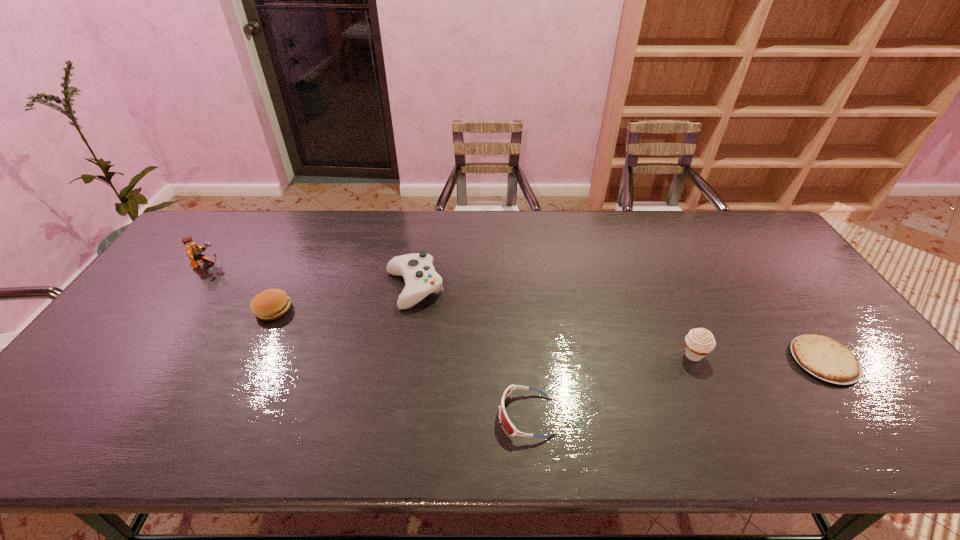
In order to click on the leftmost object in this screenshot , I will do `click(193, 250)`.

Locate an element on the screen. the fifth object from left to right is located at coordinates (699, 342).

The image size is (960, 540). What are the coordinates of `the fourth shortest object` in the screenshot? It's located at (421, 279).

Where is `the third object from left to right`? the third object from left to right is located at coordinates click(421, 279).

Find the location of `patty`. patty is located at coordinates (270, 304).

Find the location of a particular element. the fourth object from left to right is located at coordinates (505, 421).

Where is `goggles`? This screenshot has width=960, height=540. goggles is located at coordinates (505, 421).

At what (x,y) coordinates should I click in order to perform the action: click on the shortest object. Please return your answer as a coordinate pair (x, y). Image resolution: width=960 pixels, height=540 pixels. Looking at the image, I should click on (x=824, y=357).

At what (x,y) coordinates should I click in order to perform the action: click on the rightmost object. Please return your answer as a coordinate pair (x, y). This screenshot has height=540, width=960. Looking at the image, I should click on (824, 357).

The height and width of the screenshot is (540, 960). What are the coordinates of `free spot located holding a crossbow in the hands of the Lego` in the screenshot? It's located at (291, 266).